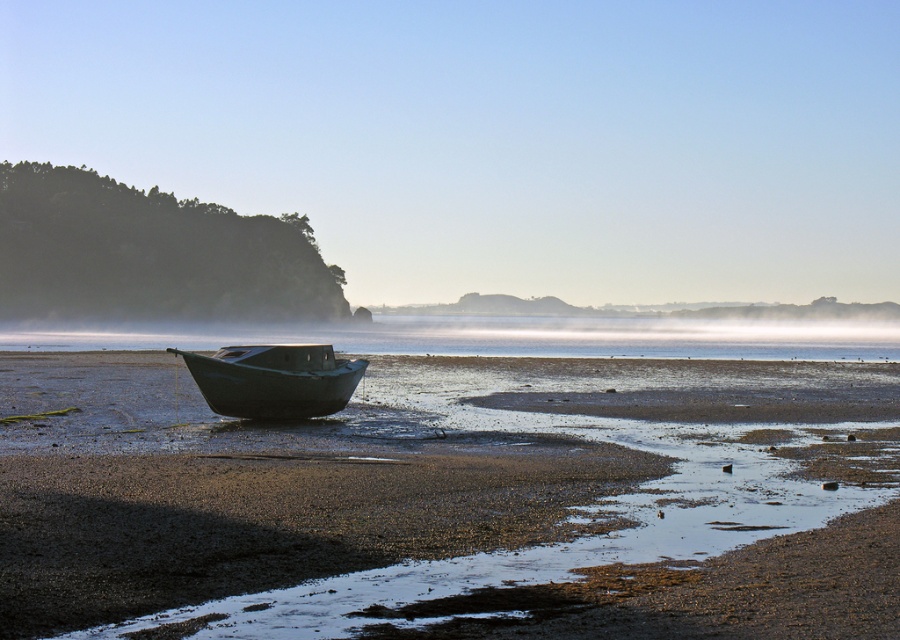
Consider the image. How distant is smooth mud boat at center from green matte boat at center?

The distance of smooth mud boat at center from green matte boat at center is 15.08 feet.

Who is lower down, smooth mud boat at center or green matte boat at center?

Positioned lower is smooth mud boat at center.

Who is more distant from viewer, (532,396) or (253,416)?

Positioned behind is point (532,396).

Locate an element on the screen. Image resolution: width=900 pixels, height=640 pixels. smooth mud boat at center is located at coordinates tap(453, 499).